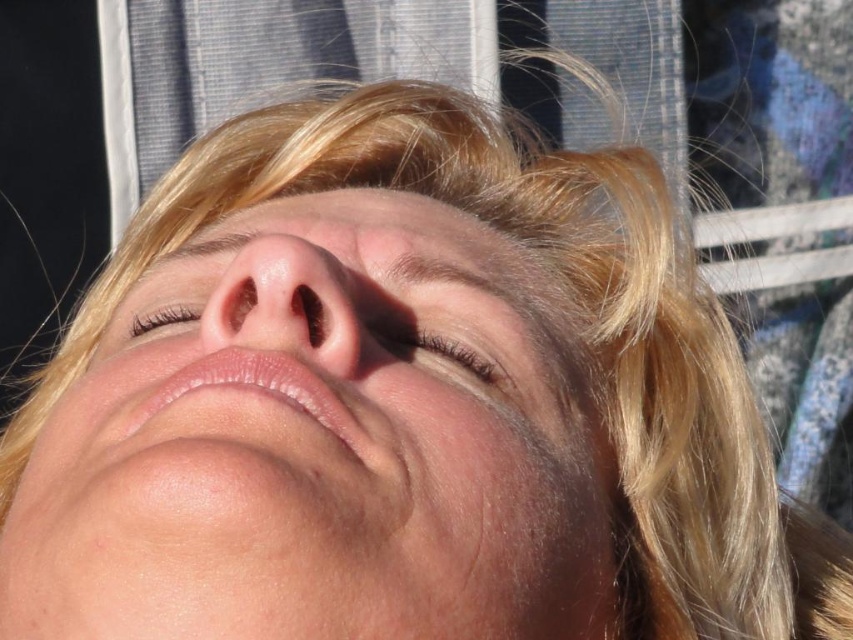
Between point (115, 586) and point (247, 336), which one is positioned in front?

Point (115, 586) is more forward.

Is smooth skin face at center closer to camera compared to pink flesh-colored nose at center?

Yes, smooth skin face at center is in front of pink flesh-colored nose at center.

I want to click on smooth skin face at center, so click(321, 445).

Where is `smooth skin face at center`? Image resolution: width=853 pixels, height=640 pixels. smooth skin face at center is located at coordinates (321, 445).

Which of these two, pink flesh-colored nose at center or brown matte eyelid at center, stands shorter?

brown matte eyelid at center is shorter.

Does pink flesh-colored nose at center lie in front of brown matte eyelid at center?

Yes, it is in front of brown matte eyelid at center.

The image size is (853, 640). In order to click on pink flesh-colored nose at center in this screenshot , I will do `click(287, 301)`.

How much distance is there between brown matte eyelid at center and brown textured eyelashes at center?

brown matte eyelid at center and brown textured eyelashes at center are 3.69 inches apart.

Where is `brown matte eyelid at center`? Image resolution: width=853 pixels, height=640 pixels. brown matte eyelid at center is located at coordinates (457, 355).

Between point (479, 348) and point (138, 314), which one is positioned behind?

Positioned behind is point (138, 314).

The width and height of the screenshot is (853, 640). What are the coordinates of `brown matte eyelid at center` in the screenshot? It's located at (457, 355).